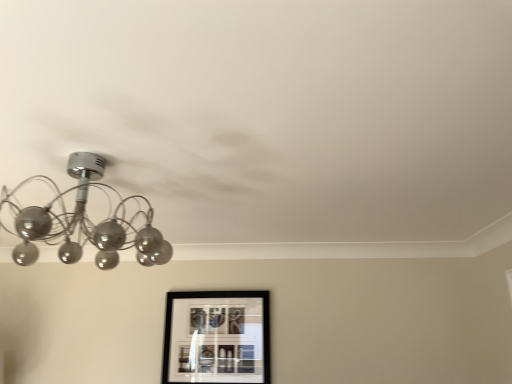
Question: Is metallic glass chandelier at upper left not near black matte picture frame at lower center?

Choices:
 (A) no
 (B) yes

Answer: (A)

Question: Does metallic glass chandelier at upper left appear on the left side of black matte picture frame at lower center?

Choices:
 (A) no
 (B) yes

Answer: (B)

Question: Does metallic glass chandelier at upper left have a lesser width compared to black matte picture frame at lower center?

Choices:
 (A) no
 (B) yes

Answer: (A)

Question: Does metallic glass chandelier at upper left have a greater height compared to black matte picture frame at lower center?

Choices:
 (A) no
 (B) yes

Answer: (A)

Question: From a real-world perspective, is metallic glass chandelier at upper left over black matte picture frame at lower center?

Choices:
 (A) no
 (B) yes

Answer: (B)

Question: Is metallic glass chandelier at upper left facing towards black matte picture frame at lower center?

Choices:
 (A) no
 (B) yes

Answer: (A)

Question: Is metallic glass chandelier at upper left at the back of black matte picture frame at lower center?

Choices:
 (A) yes
 (B) no

Answer: (B)

Question: Can you see black matte picture frame at lower center touching metallic glass chandelier at upper left?

Choices:
 (A) no
 (B) yes

Answer: (A)

Question: Is black matte picture frame at lower center wider than metallic glass chandelier at upper left?

Choices:
 (A) no
 (B) yes

Answer: (A)

Question: From the image's perspective, is black matte picture frame at lower center below metallic glass chandelier at upper left?

Choices:
 (A) no
 (B) yes

Answer: (B)

Question: Could you tell me if black matte picture frame at lower center is facing metallic glass chandelier at upper left?

Choices:
 (A) no
 (B) yes

Answer: (B)

Question: Considering the relative sizes of black matte picture frame at lower center and metallic glass chandelier at upper left in the image provided, is black matte picture frame at lower center smaller than metallic glass chandelier at upper left?

Choices:
 (A) no
 (B) yes

Answer: (B)

Question: Considering the positions of metallic glass chandelier at upper left and black matte picture frame at lower center in the image, is metallic glass chandelier at upper left wider or thinner than black matte picture frame at lower center?

Choices:
 (A) wide
 (B) thin

Answer: (A)